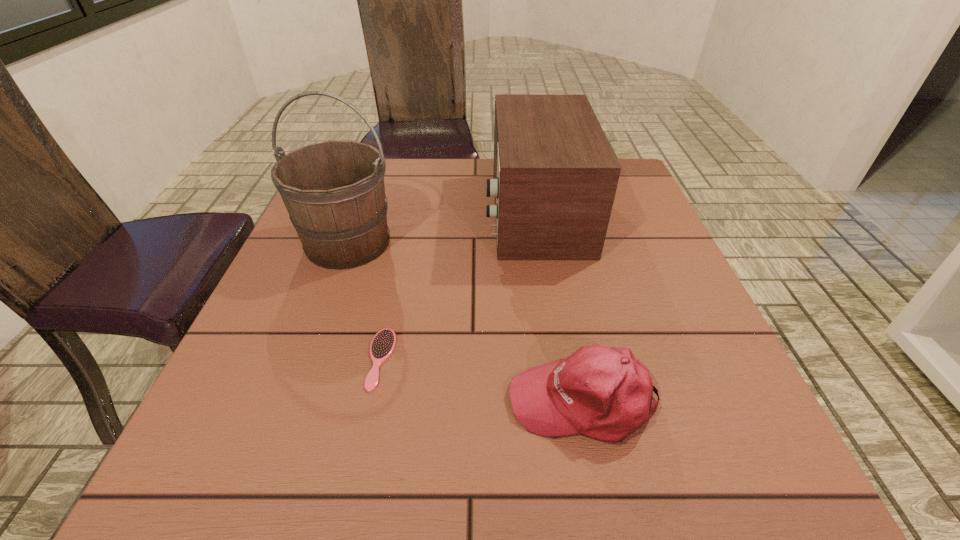
I want to click on blank space at the right edge, so click(x=631, y=285).

This screenshot has width=960, height=540. In order to click on vacant point at the near right corner in this screenshot , I will do `click(763, 447)`.

Locate an element on the screen. Image resolution: width=960 pixels, height=540 pixels. empty space that is in between the shortest object and the bucket is located at coordinates (365, 301).

Identify the location of unoccupied area between the tallest object and the second tallest object. (442, 228).

Find the location of `free space between the third shortest object and the third tallest object`. free space between the third shortest object and the third tallest object is located at coordinates (560, 307).

What are the coordinates of `vacant region between the bucket and the hairbrush` in the screenshot? It's located at (365, 301).

At what (x,y) coordinates should I click in order to perform the action: click on free area in between the tallest object and the second shortest object. Please return your answer as a coordinate pair (x, y). Looking at the image, I should click on (466, 322).

Find the location of a particular element. free space between the tallest object and the hairbrush is located at coordinates (365, 301).

Find the location of a particular element. vacant point located between the second shortest object and the hairbrush is located at coordinates (482, 380).

This screenshot has height=540, width=960. In order to click on free space between the baseball cap and the radio receiver in this screenshot , I will do `click(560, 307)`.